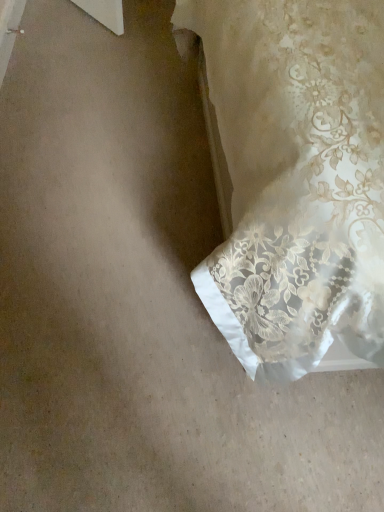
Question: Should I look upward or downward to see white lace curtain at lower right?

Choices:
 (A) down
 (B) up

Answer: (B)